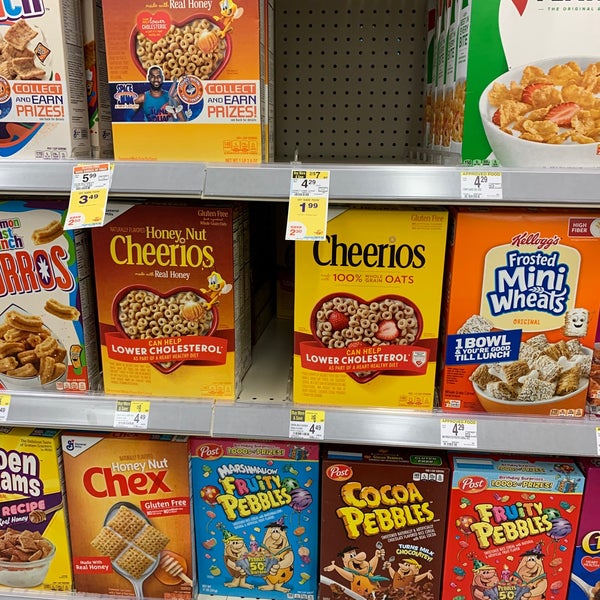
Find the location of a particular element. middle shelf of cereal is located at coordinates (28, 337), (172, 339), (250, 281), (335, 289), (499, 303), (594, 381).